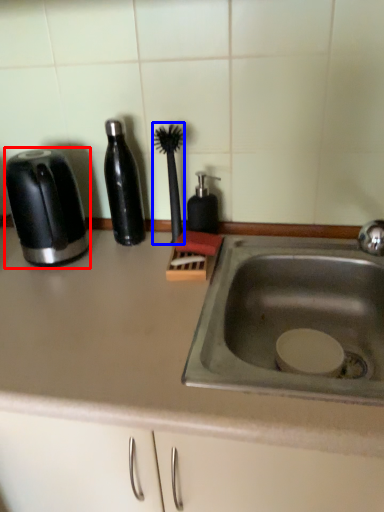
Question: Which object appears farthest to the camera in this image, toaster (highlighted by a red box) or brush (highlighted by a blue box)?

Choices:
 (A) toaster
 (B) brush

Answer: (B)